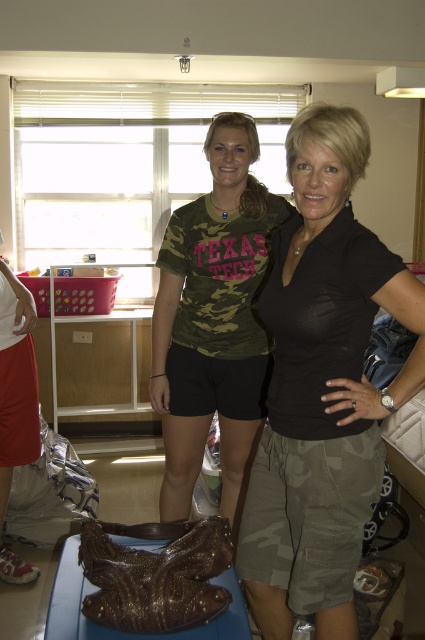
Question: Is camo fabric shirt at center thinner than shiny metallic shoe at lower left?

Choices:
 (A) no
 (B) yes

Answer: (A)

Question: Is matte black shirt at center to the right of shiny metallic shoe at lower left from the viewer's perspective?

Choices:
 (A) no
 (B) yes

Answer: (B)

Question: Among these objects, which one is nearest to the camera?

Choices:
 (A) camo fabric shirt at center
 (B) shiny metallic shoe at lower left

Answer: (A)

Question: Does matte black shirt at center have a greater width compared to camo fabric shirt at center?

Choices:
 (A) yes
 (B) no

Answer: (B)

Question: Which point appears farthest from the camera in this image?

Choices:
 (A) (2, 424)
 (B) (316, 550)
 (C) (240, 125)

Answer: (A)

Question: Which point is closer to the camera?

Choices:
 (A) (180, 381)
 (B) (340, 156)
 (C) (2, 305)

Answer: (B)